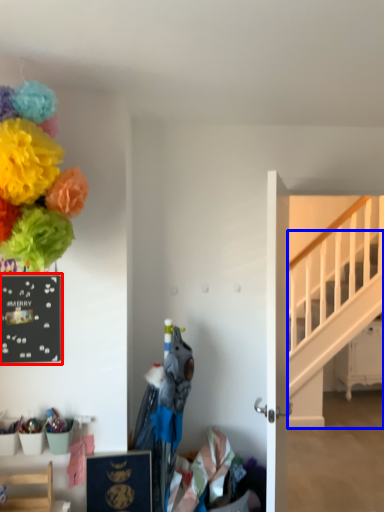
Question: Which object is closer to the camera taking this photo, bulletin board (highlighted by a red box) or stairs (highlighted by a blue box)?

Choices:
 (A) bulletin board
 (B) stairs

Answer: (A)